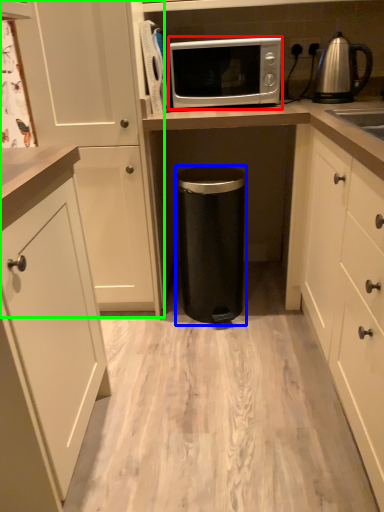
Question: Considering the real-world distances, which object is farthest from microwave oven (highlighted by a red box)? appliance (highlighted by a blue box) or cabinetry (highlighted by a green box)?

Choices:
 (A) appliance
 (B) cabinetry

Answer: (A)